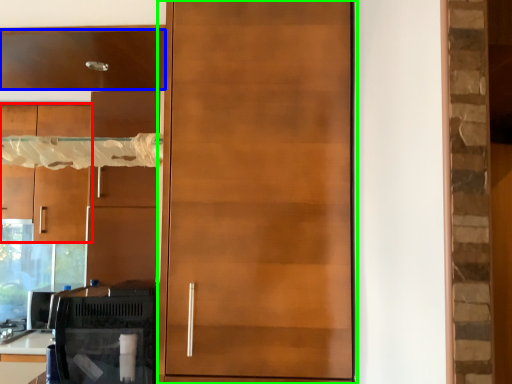
Question: Which is nearer to the cabinetry (highlighted by a red box)? cabinetry (highlighted by a blue box) or door (highlighted by a green box).

Choices:
 (A) cabinetry
 (B) door

Answer: (A)